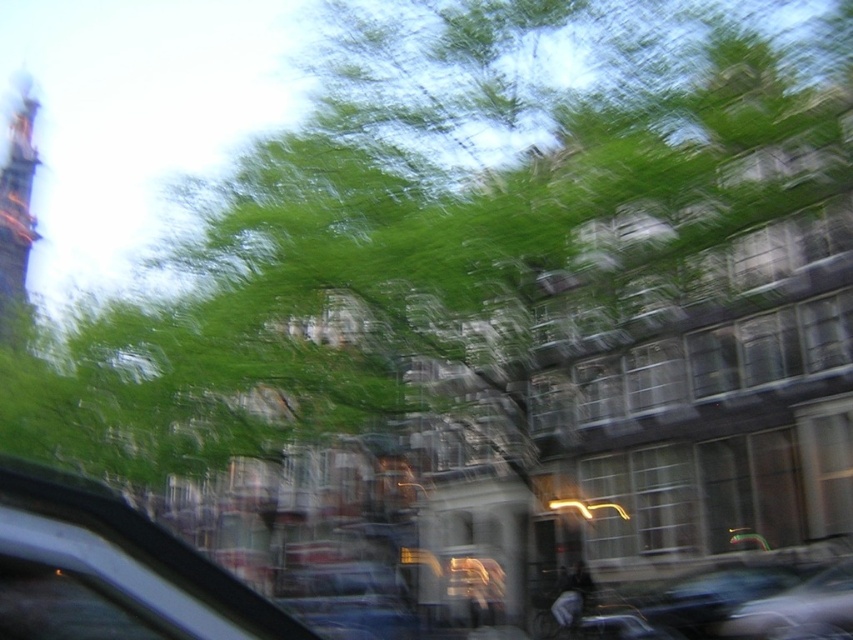
Looking at this image, you are a passenger in a car and want to know if you can see the dark brown wooden tower at upper left through the transparent glass car window at lower left. Considering their heights, can you see it?

The transparent glass car window at lower left has a lesser height compared to dark brown wooden tower at upper left, so the tower is taller than the window. Since the window is lower and shorter, you might not be able to see the entire tower through it unless you adjust your position.